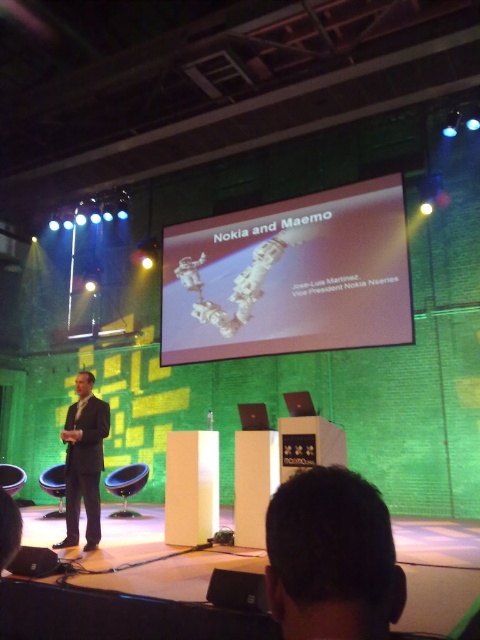
You are an attendee sitting in the front row of the auditorium. You want to look at both the dark suit at center and the white glossy projector screen at upper center. Which object will you need to tilt your head upwards more to see?

The white glossy projector screen at upper center is further to the viewer than the dark suit at center, so you would need to tilt your head upwards more to see the dark suit at center since it is positioned behind and likely higher up than the screen.